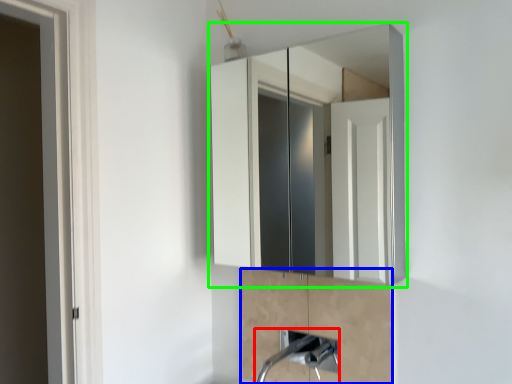
Question: Estimate the real-world distances between objects in this image. Which object is farther from plumbing fixture (highlighted by a red box), cabinetry (highlighted by a blue box) or medicine cabinet (highlighted by a green box)?

Choices:
 (A) cabinetry
 (B) medicine cabinet

Answer: (B)